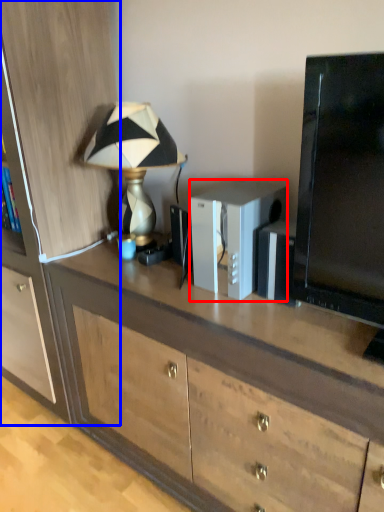
Question: Which of the following is the farthest to the observer, appliance (highlighted by a red box) or cabinetry (highlighted by a blue box)?

Choices:
 (A) appliance
 (B) cabinetry

Answer: (B)